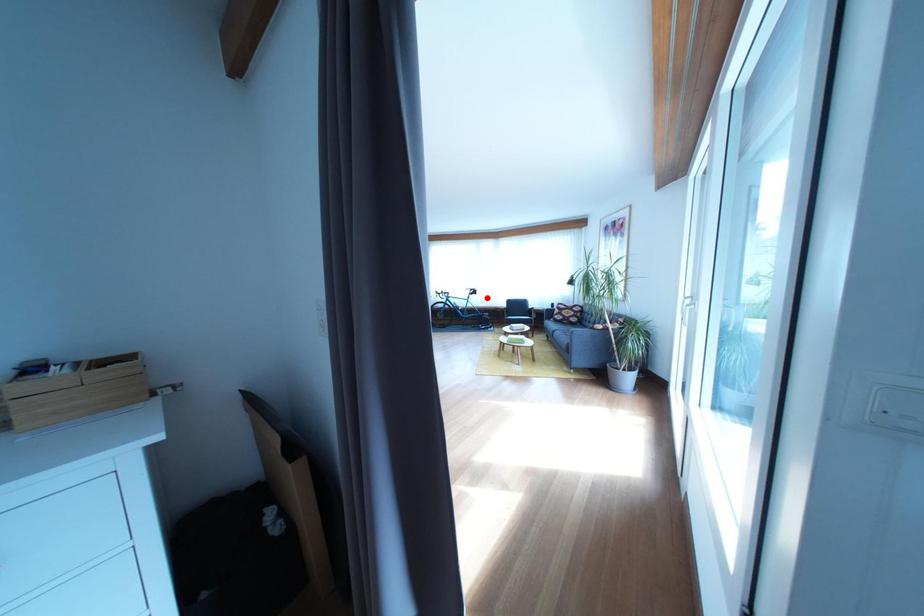
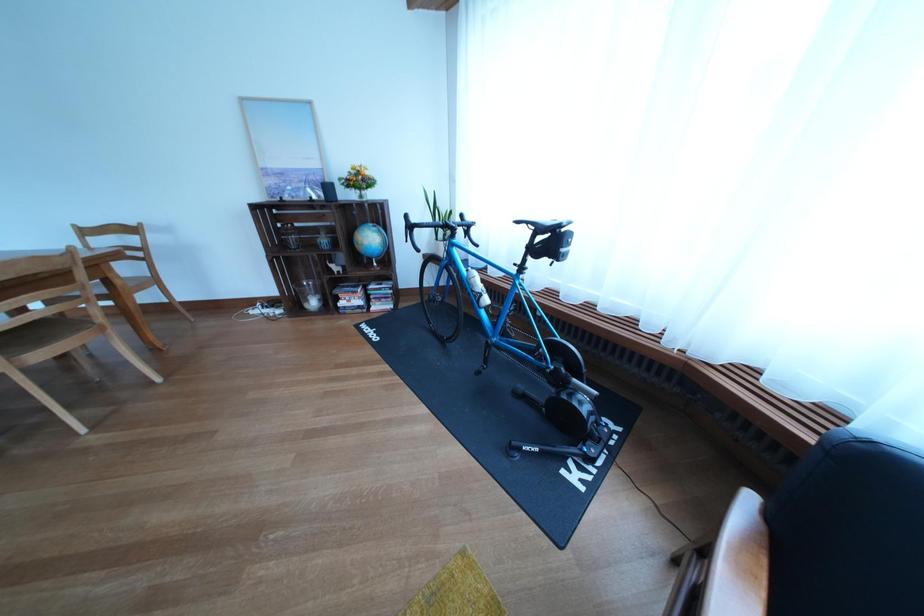
Question: I am providing you with two images of the same scene from different viewpoints. A red point is shown in image1. For the corresponding object point in image2, is it positioned nearer or farther from the camera?

Choices:
 (A) Nearer
 (B) Farther

Answer: (B)